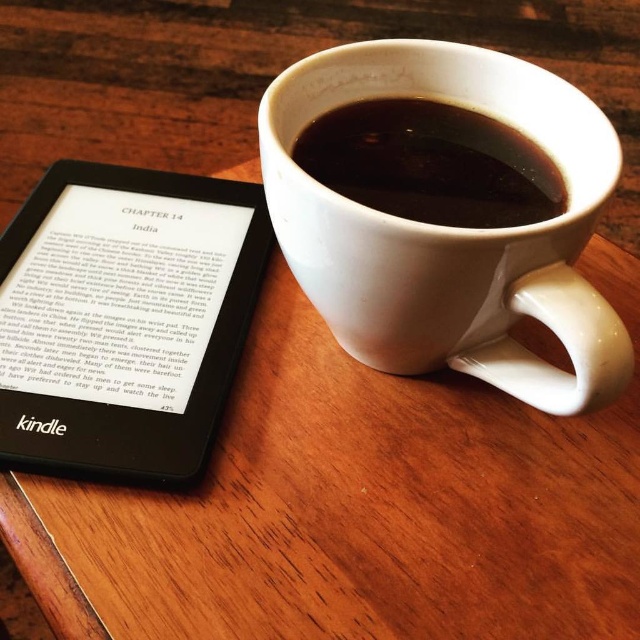
Question: Which point appears closest to the camera in this image?

Choices:
 (A) (422, 236)
 (B) (243, 292)

Answer: (A)

Question: Considering the relative positions of white ceramic mug at upper center and black matte kindle at left in the image provided, where is white ceramic mug at upper center located with respect to black matte kindle at left?

Choices:
 (A) left
 (B) right

Answer: (B)

Question: Does black matte kindle at left have a smaller size compared to black glossy mug at upper center?

Choices:
 (A) no
 (B) yes

Answer: (A)

Question: Is the position of black matte kindle at left more distant than that of black glossy mug at upper center?

Choices:
 (A) yes
 (B) no

Answer: (A)

Question: Which object appears farthest from the camera in this image?

Choices:
 (A) white ceramic mug at upper center
 (B) black matte kindle at left

Answer: (B)

Question: Based on their relative distances, which object is farther from the white ceramic mug at upper center?

Choices:
 (A) black glossy mug at upper center
 (B) black matte kindle at left

Answer: (B)